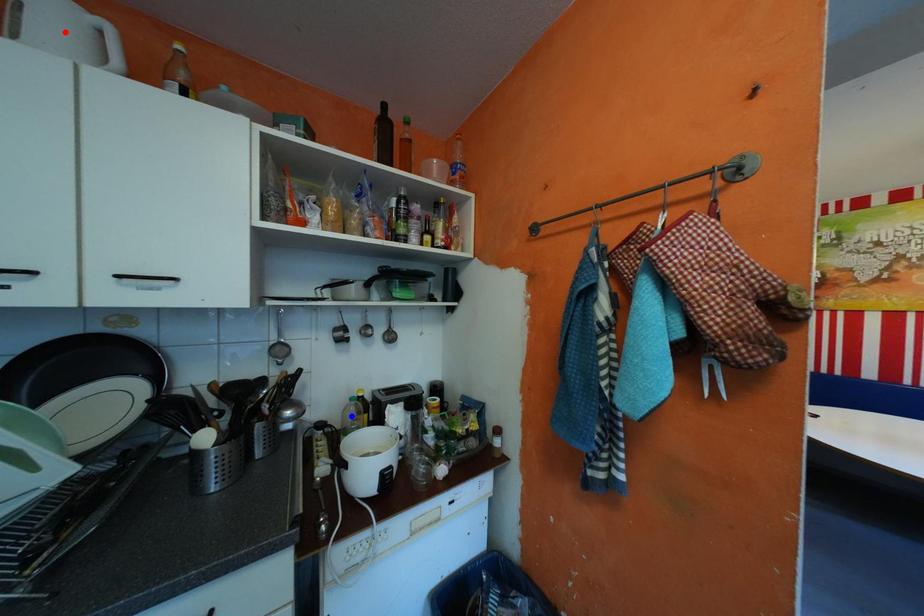
Question: In the image, two points are highlighted. Which point is nearer to the camera? Reply with the corresponding letter.

Choices:
 (A) blue point
 (B) red point

Answer: (B)